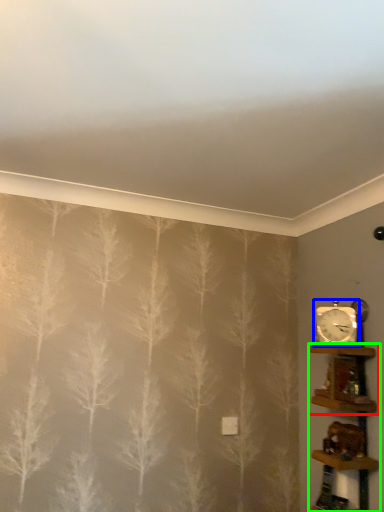
Question: Which is farther away from shelf (highlighted by a red box)? clock (highlighted by a blue box) or shelf (highlighted by a green box)?

Choices:
 (A) clock
 (B) shelf

Answer: (A)